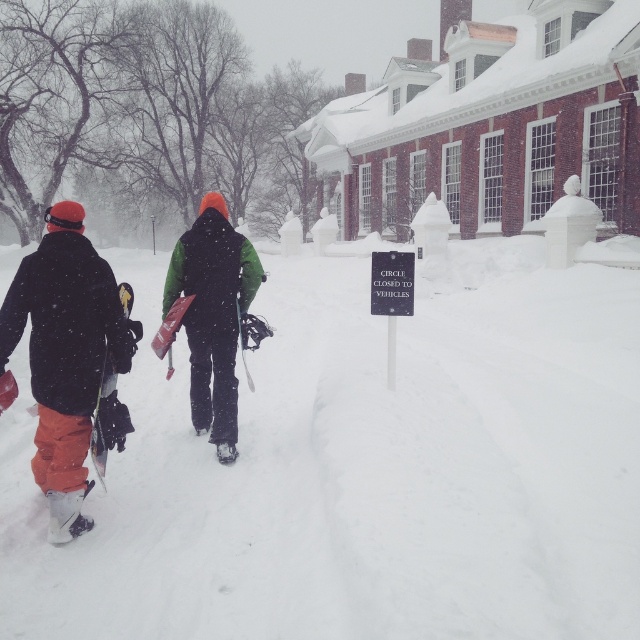
You are an observer standing at the camera position. You see the green fabric jacket at center and the white rubber snowshoe at lower center. Which object is wider when viewed from your position?

The green fabric jacket at center is wider than the white rubber snowshoe at lower center.

Based on the photo, based on the scene description, where is the green fabric jacket at center located in terms of its position relative to the other elements in the image?

The green fabric jacket at center is located at the center of the image, positioned at coordinates approximately 0.487 on the x axis and 0.333 on the y axis.